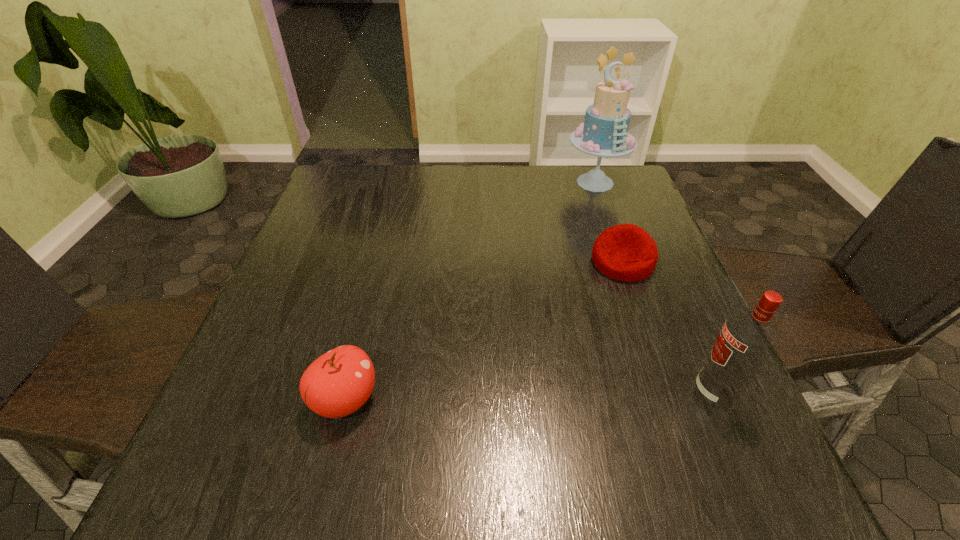
What are the coordinates of `the second shortest object` in the screenshot? It's located at (339, 382).

This screenshot has height=540, width=960. What are the coordinates of `apple` in the screenshot? It's located at (339, 382).

I want to click on vodka, so click(x=747, y=339).

The height and width of the screenshot is (540, 960). I want to click on the shortest object, so click(x=625, y=252).

Find the location of a particular element. beanbag is located at coordinates (625, 252).

I want to click on the tallest object, so click(x=604, y=133).

Image resolution: width=960 pixels, height=540 pixels. What are the coordinates of `cake` in the screenshot? It's located at (604, 133).

At what (x,y) coordinates should I click in order to perform the action: click on free space located on the right of the third tallest object. Please return your answer as a coordinate pair (x, y). The image size is (960, 540). Looking at the image, I should click on (414, 400).

This screenshot has width=960, height=540. What are the coordinates of `free space located 0.110m on the front label of the vodka` in the screenshot? It's located at (629, 393).

Locate an element on the screen. The image size is (960, 540). vacant space located 0.300m on the front label of the vodka is located at coordinates (520, 393).